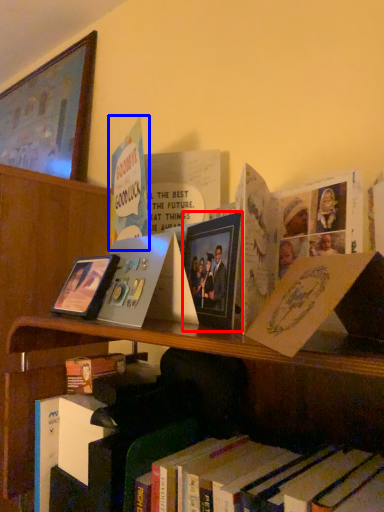
Question: Among these objects, which one is nearest to the camera, picture frame (highlighted by a red box) or book (highlighted by a blue box)?

Choices:
 (A) picture frame
 (B) book

Answer: (A)